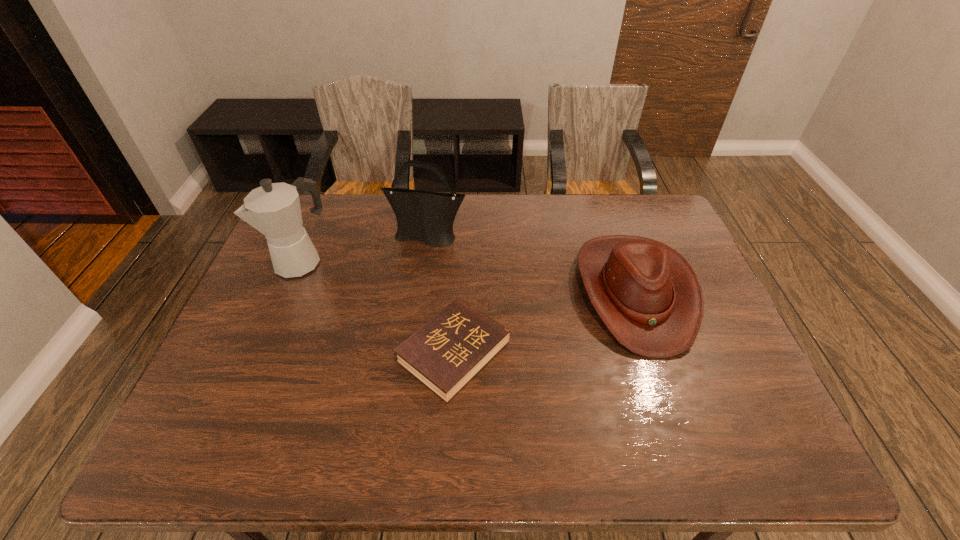
Find the location of `free space that satisfies the following two spatial constraints: 1. on the front side of the shoulder bag; 2. on the right side of the shortest object`. free space that satisfies the following two spatial constraints: 1. on the front side of the shoulder bag; 2. on the right side of the shortest object is located at coordinates (412, 352).

I want to click on free region that satisfies the following two spatial constraints: 1. on the back side of the coffeepot; 2. on the right side of the shoulder bag, so click(x=312, y=238).